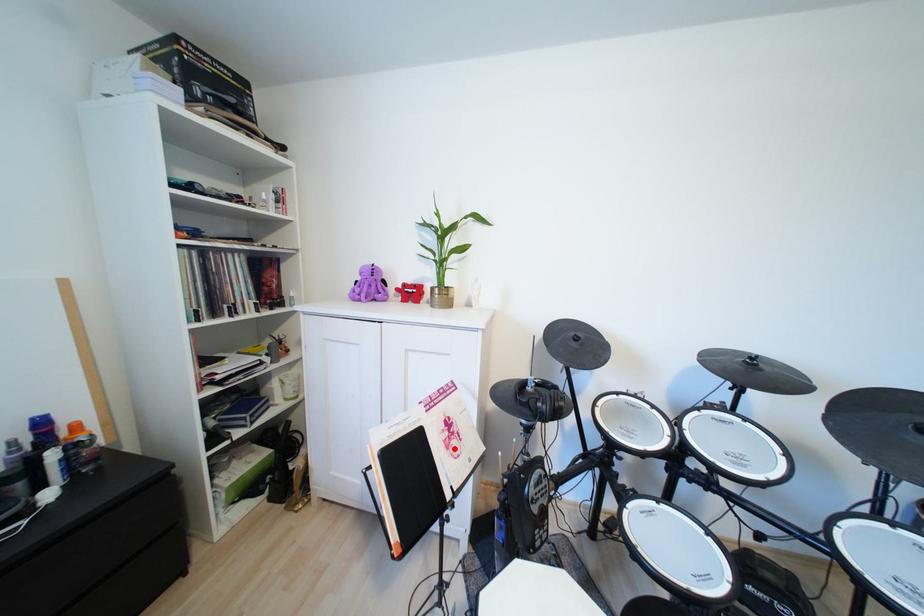
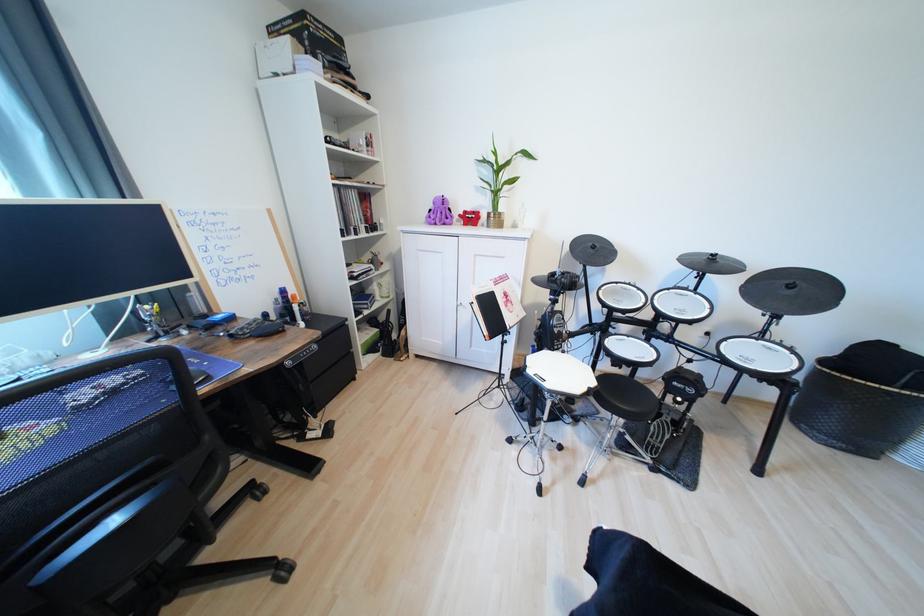
Question: I am providing you with two images of the same scene from different viewpoints. A red point is marked on the first image. Can you still see the location of the red point in image 2?

Choices:
 (A) Yes
 (B) No

Answer: (A)